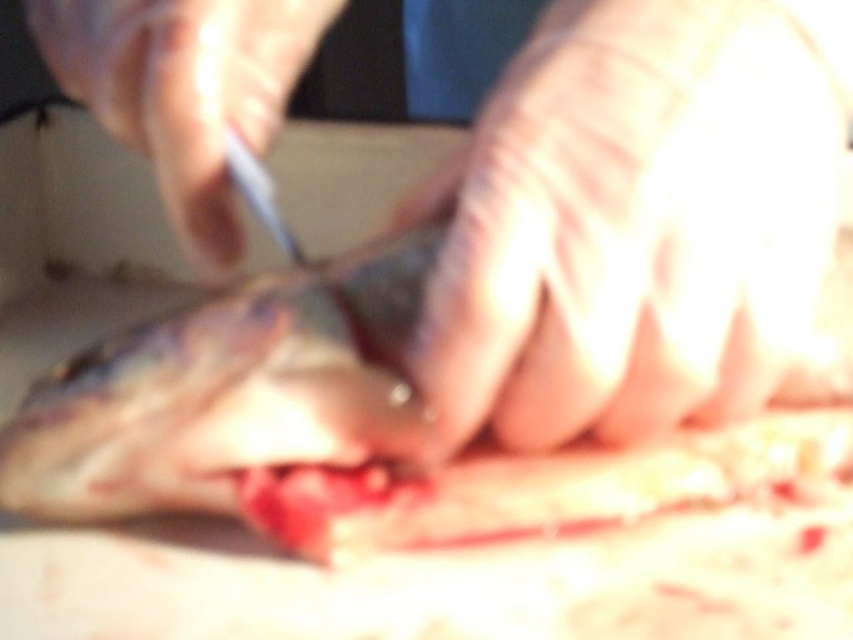
Question: Estimate the real-world distances between objects in this image. Which object is closer to the gloved hand at upper center?

Choices:
 (A) flesh-colored skin at center
 (B) pinkish flesh at center

Answer: (B)

Question: From the image, what is the correct spatial relationship of pinkish flesh at center in relation to gloved hand at upper center?

Choices:
 (A) right
 (B) left

Answer: (A)

Question: Is pinkish flesh at center positioned in front of gloved hand at upper center?

Choices:
 (A) yes
 (B) no

Answer: (A)

Question: Can you confirm if flesh-colored skin at center is smaller than gloved hand at upper center?

Choices:
 (A) yes
 (B) no

Answer: (A)

Question: Estimate the real-world distances between objects in this image. Which object is farther from the pinkish flesh at center?

Choices:
 (A) gloved hand at upper center
 (B) flesh-colored skin at center

Answer: (B)

Question: Which of the following is the farthest from the observer?

Choices:
 (A) flesh-colored skin at center
 (B) pinkish flesh at center
 (C) gloved hand at upper center

Answer: (C)